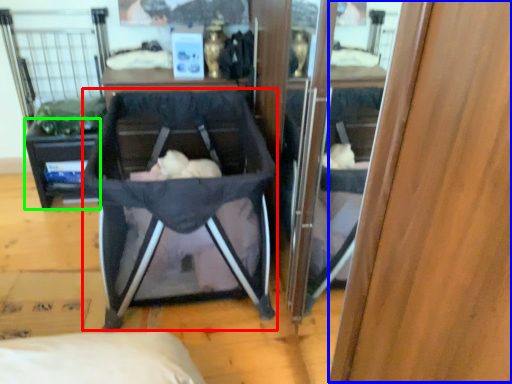
Question: Which object is the closest to the baby carriage (highlighted by a red box)? Choose among these: wood (highlighted by a blue box) or vanity (highlighted by a green box).

Choices:
 (A) wood
 (B) vanity

Answer: (B)